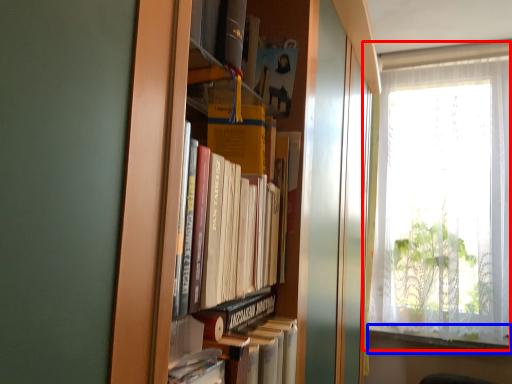
Question: Which object is further to the camera taking this photo, window (highlighted by a red box) or window sill (highlighted by a blue box)?

Choices:
 (A) window
 (B) window sill

Answer: (B)